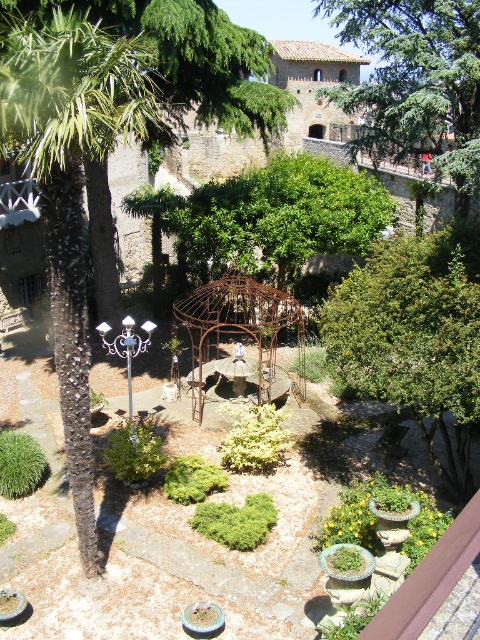
Based on the photo, is green leafy tree at upper center thinner than rusty metal gazebo at center?

In fact, green leafy tree at upper center might be wider than rusty metal gazebo at center.

Does green leafy tree at upper center appear on the left side of rusty metal gazebo at center?

No, green leafy tree at upper center is not to the left of rusty metal gazebo at center.

Between point (434, 29) and point (297, 312), which one is positioned in front?

Positioned in front is point (434, 29).

This screenshot has height=640, width=480. What are the coordinates of `green leafy tree at upper center` in the screenshot? It's located at (417, 81).

Is dark brown textured palm tree at left wider than rusty metal gazebo at center?

In fact, dark brown textured palm tree at left might be narrower than rusty metal gazebo at center.

Does dark brown textured palm tree at left have a smaller size compared to rusty metal gazebo at center?

Incorrect, dark brown textured palm tree at left is not smaller in size than rusty metal gazebo at center.

Identify the location of dark brown textured palm tree at left. This screenshot has height=640, width=480. (72, 189).

Locate an element on the screen. This screenshot has height=640, width=480. dark brown textured palm tree at left is located at coordinates (72, 189).

Which is in front, point (81, 256) or point (411, 241)?

Point (81, 256)

Where is `dark brown textured palm tree at left`? The height and width of the screenshot is (640, 480). dark brown textured palm tree at left is located at coordinates 72,189.